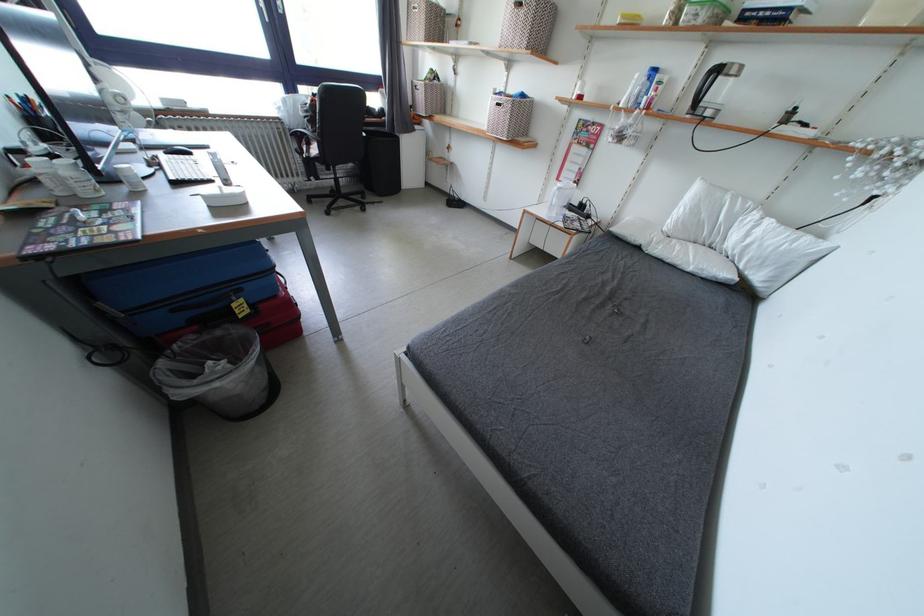
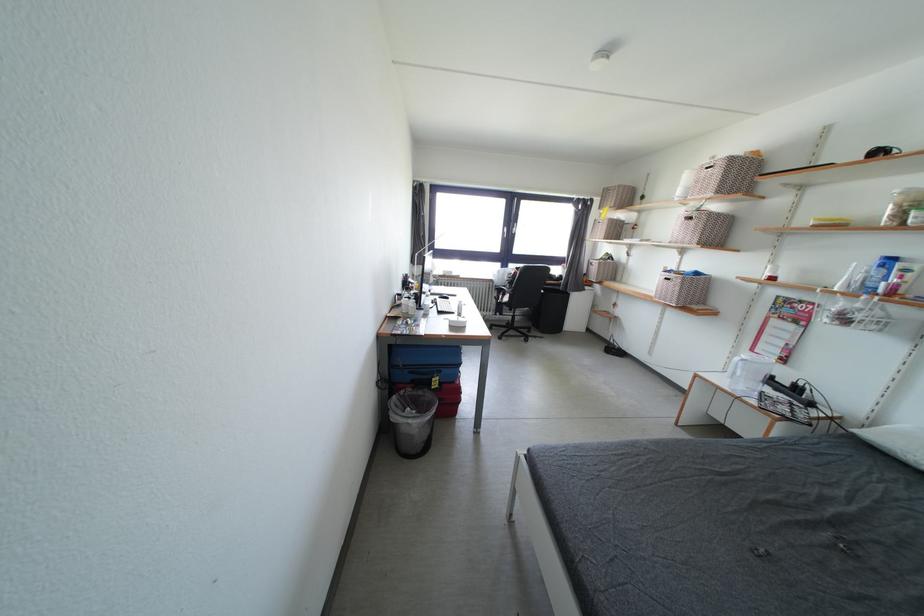
The point at [564,184] is marked in the first image. Where is the corresponding point in the second image?

(759, 355)